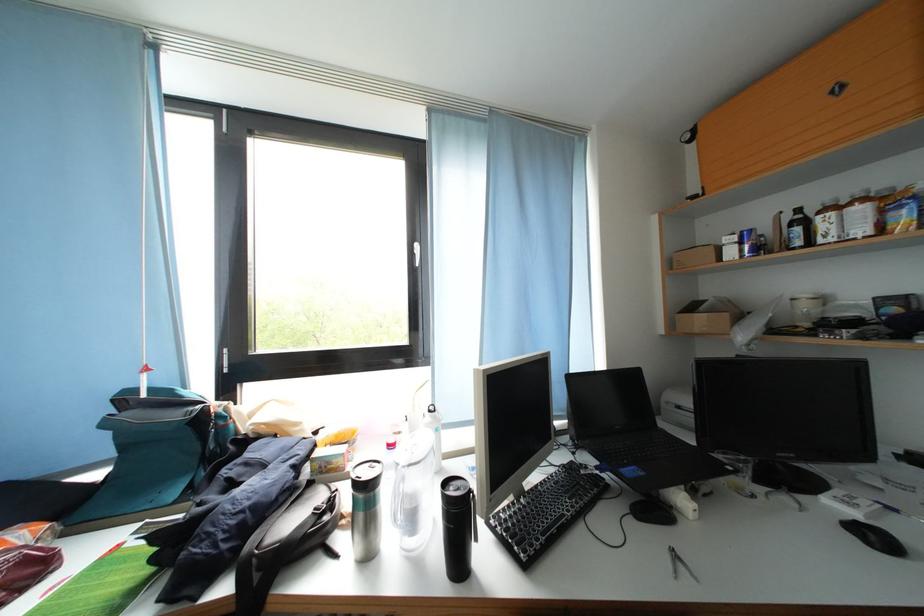
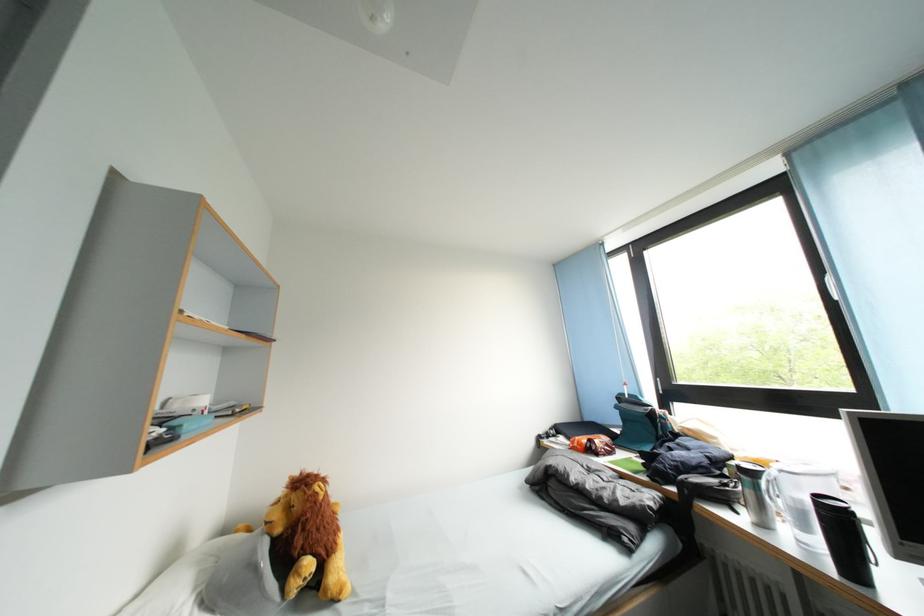
Question: The images are taken continuously from a first-person perspective. In which direction is your viewpoint rotating?

Choices:
 (A) Left
 (B) Right
 (C) Up
 (D) Down

Answer: (A)